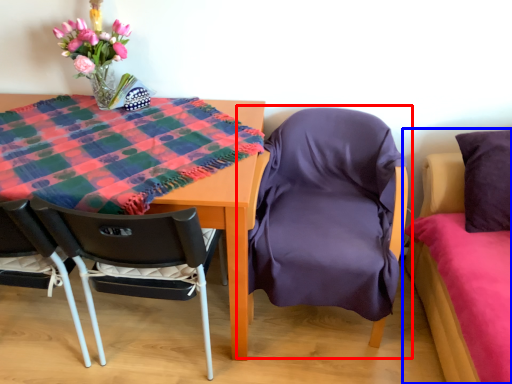
Question: Which point is further to the camera, chair (highlighted by a red box) or bed (highlighted by a blue box)?

Choices:
 (A) chair
 (B) bed

Answer: (A)